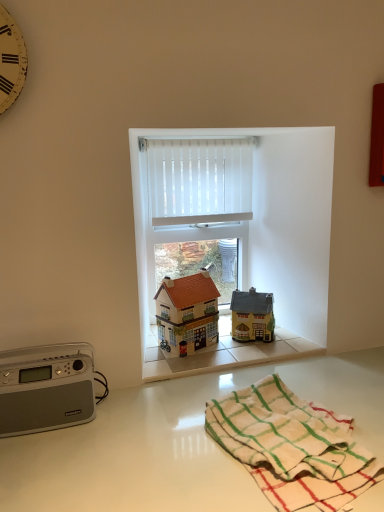
Locate an element on the screen. free space above white glossy countertop at lower center (from a real-world perspective) is located at coordinates (203, 432).